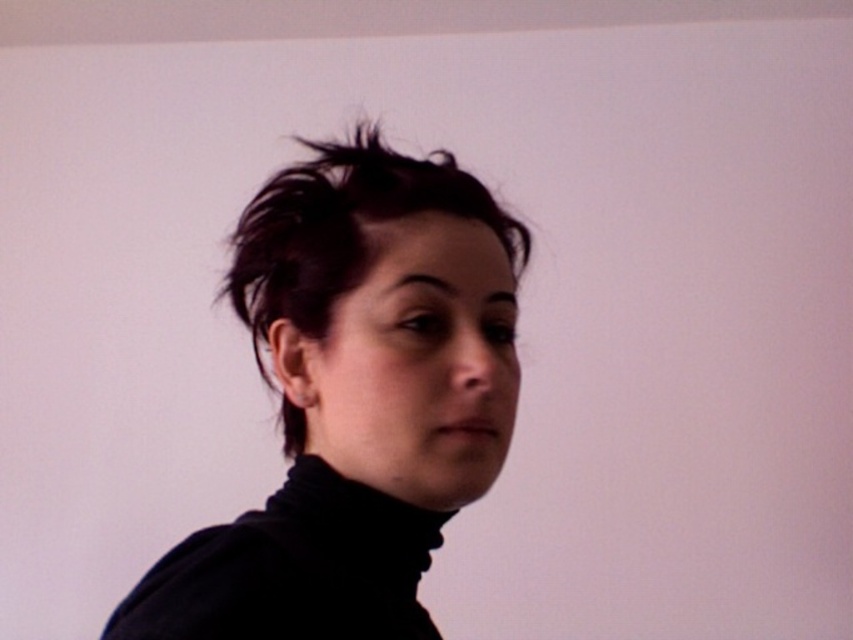
Question: Among these objects, which one is farthest from the camera?

Choices:
 (A) matte black face at center
 (B) matte black turtleneck at center
 (C) black turtleneck at center
 (D) dark brown hair at center

Answer: (D)

Question: Is dark brown hair at center to the right of black turtleneck at center from the viewer's perspective?

Choices:
 (A) no
 (B) yes

Answer: (A)

Question: Can you confirm if matte black face at center is thinner than dark brown hair at center?

Choices:
 (A) no
 (B) yes

Answer: (B)

Question: Among these points, which one is nearest to the camera?

Choices:
 (A) (456, 212)
 (B) (416, 417)

Answer: (B)

Question: Which point is closer to the camera taking this photo?

Choices:
 (A) (318, 509)
 (B) (274, 268)
 (C) (340, 474)
 (D) (390, 637)

Answer: (D)

Question: Does matte black face at center lie behind dark brown hair at center?

Choices:
 (A) yes
 (B) no

Answer: (B)